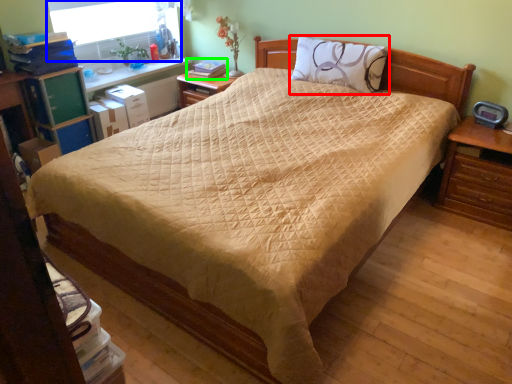
Question: Considering the real-world distances, which object is farthest from pillow (highlighted by a red box)? window screen (highlighted by a blue box) or book (highlighted by a green box)?

Choices:
 (A) window screen
 (B) book

Answer: (A)